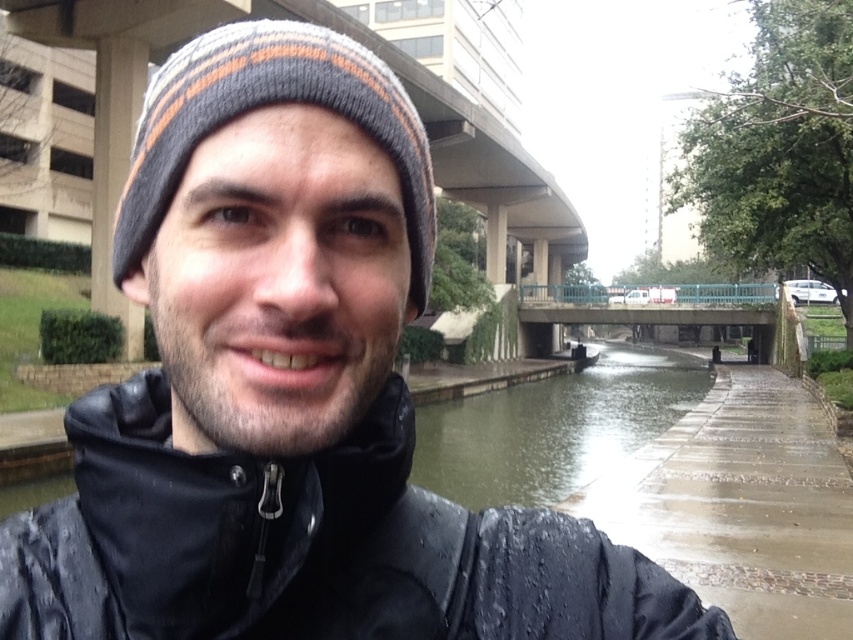
Question: Does waterproof black jacket at center have a smaller size compared to knit woolen beanie at center?

Choices:
 (A) no
 (B) yes

Answer: (B)

Question: Which of these objects is positioned farthest from the waterproof black jacket at center?

Choices:
 (A) knit woolen beanie at center
 (B) greenish concrete river at center

Answer: (B)

Question: Is knit woolen beanie at center above greenish concrete river at center?

Choices:
 (A) yes
 (B) no

Answer: (A)

Question: Which is farther from the knit woolen beanie at center?

Choices:
 (A) waterproof black jacket at center
 (B) greenish concrete river at center

Answer: (B)

Question: Among these points, which one is nearest to the camera?

Choices:
 (A) (286, 493)
 (B) (527, 472)
 (C) (149, 225)

Answer: (A)

Question: Does waterproof black jacket at center lie in front of greenish concrete river at center?

Choices:
 (A) yes
 (B) no

Answer: (A)